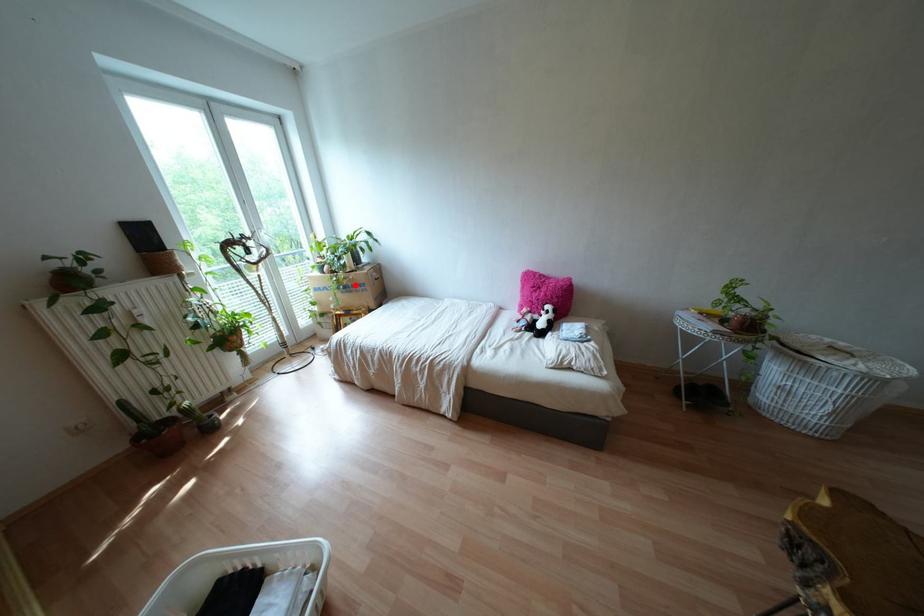
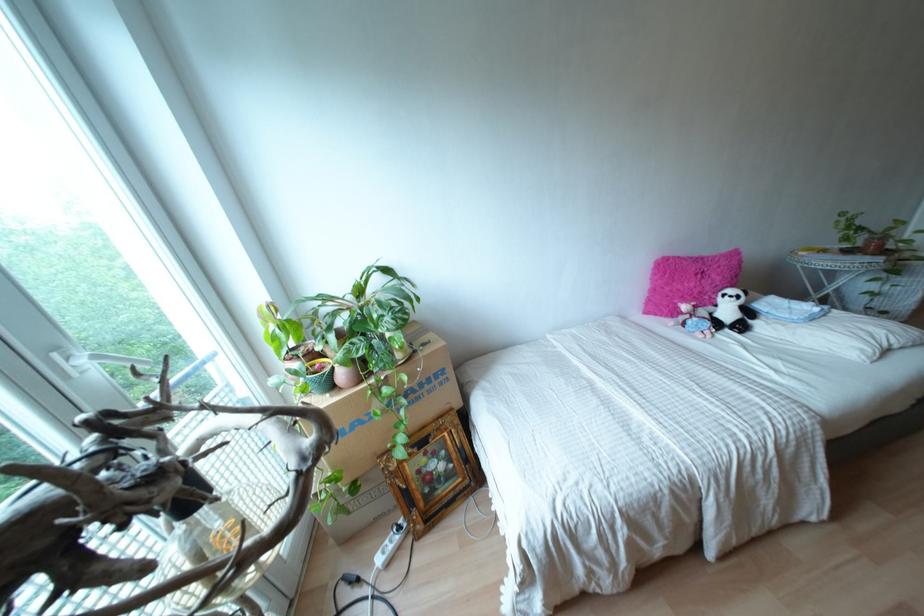
Question: I am providing you with two images of the same scene from different viewpoints. A red point is marked on the first image. At the location where the point appears in image 1, is it still visible in image 2?

Choices:
 (A) Yes
 (B) No

Answer: (A)